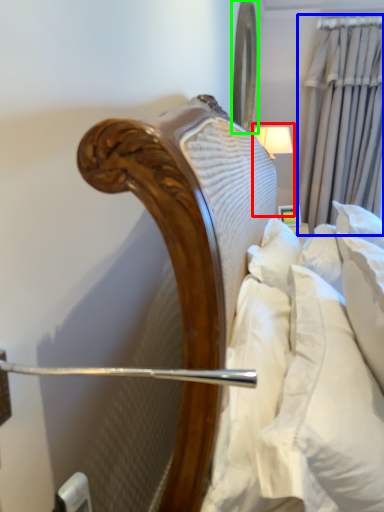
Question: Considering the real-world distances, which object is farthest from bedside lamp (highlighted by a red box)? curtain (highlighted by a blue box) or mirror (highlighted by a green box)?

Choices:
 (A) curtain
 (B) mirror

Answer: (A)